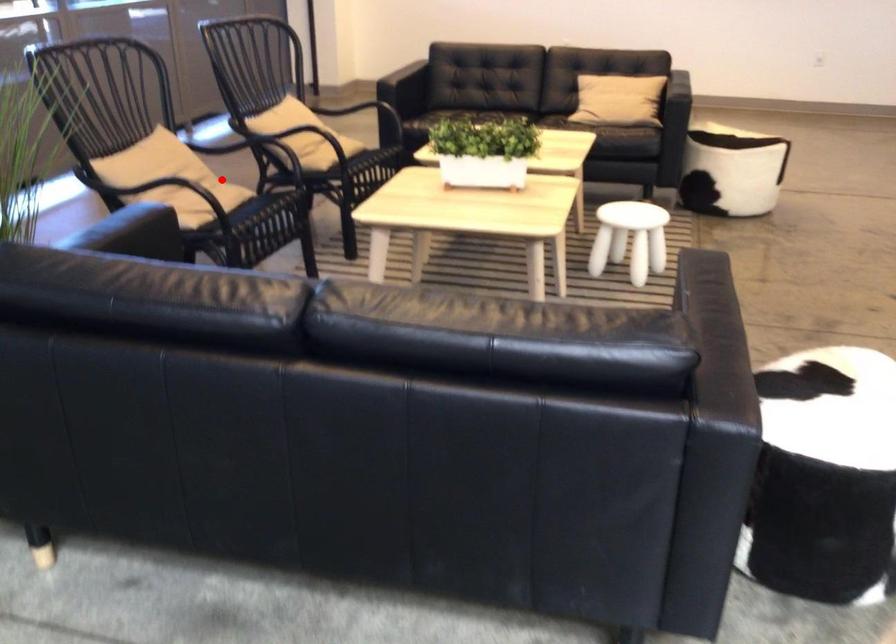
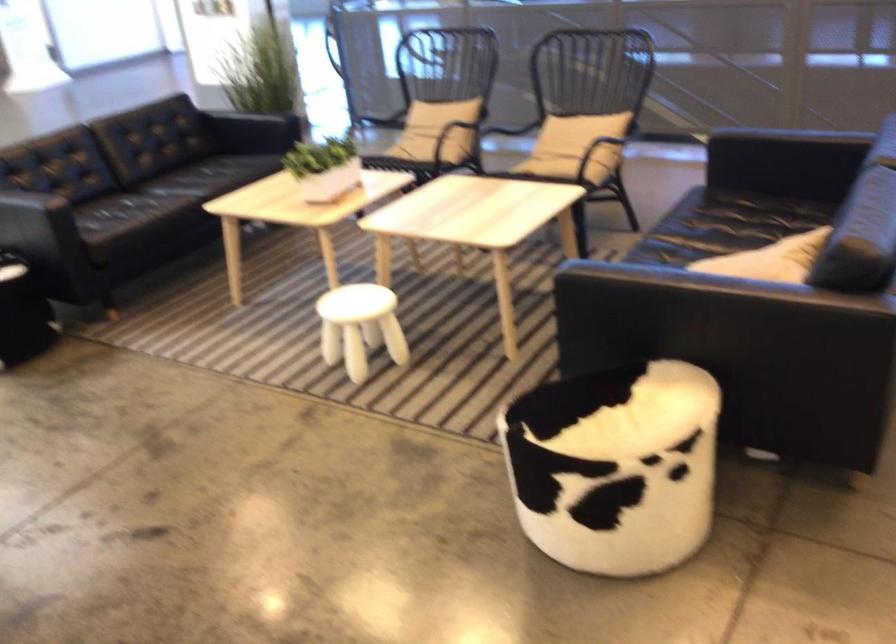
Question: A red point is marked in image1. In image2, is the corresponding 3D point closer to the camera or farther? Reply with the corresponding letter.

Choices:
 (A) The corresponding 3D point is closer.
 (B) The corresponding 3D point is farther.

Answer: (B)